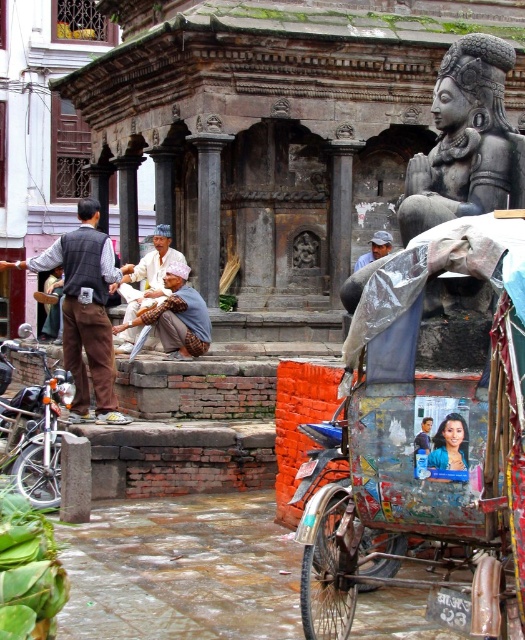
Question: Which point is farther to the camera?

Choices:
 (A) (353, 392)
 (B) (444, 433)
 (C) (365, 253)

Answer: (C)

Question: Considering the relative positions of metallic painted cart at center and dark brown fabric vest at left in the image provided, where is metallic painted cart at center located with respect to dark brown fabric vest at left?

Choices:
 (A) right
 (B) left

Answer: (A)

Question: Considering the real-world distances, which object is farthest from the smooth skin face at center?

Choices:
 (A) metallic blue tricycle at lower left
 (B) dark brown fabric vest at left

Answer: (B)

Question: Does metallic painted cart at center have a larger size compared to black stone statue at upper right?

Choices:
 (A) yes
 (B) no

Answer: (B)

Question: Which point is closer to the camera taking this photo?

Choices:
 (A) (36, 387)
 (B) (108, 348)
 (C) (385, 241)

Answer: (A)

Question: Is metallic blue tricycle at lower left thinner than smooth skin face at center?

Choices:
 (A) no
 (B) yes

Answer: (A)